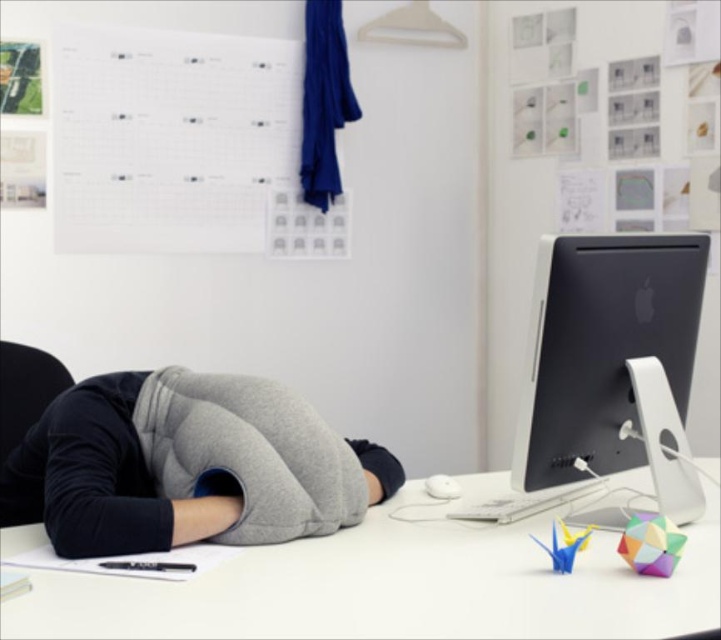
Can you confirm if white paperboard at upper center is wider than gray fleece pillow at center?

Indeed, white paperboard at upper center has a greater width compared to gray fleece pillow at center.

In the scene shown: Is white paperboard at upper center taller than gray fleece pillow at center?

Yes.

Is point (288, 116) positioned after point (120, 547)?

Yes, point (288, 116) is farther from viewer.

The width and height of the screenshot is (721, 640). I want to click on white paperboard at upper center, so click(x=181, y=145).

Between white matte computer desk at center and gray fleece pillow at center, which one has more height?

gray fleece pillow at center is taller.

Does point (319, 593) come farther from viewer compared to point (99, 433)?

No, (319, 593) is closer to viewer.

I want to click on white matte computer desk at center, so click(x=393, y=586).

Which is more to the left, gray fleece pillow at center or black matte desktop computer at right?

Positioned to the left is gray fleece pillow at center.

Does point (35, 454) lie behind point (663, 484)?

Yes, it is behind point (663, 484).

Who is more forward, (115, 465) or (561, 474)?

Positioned in front is point (115, 465).

I want to click on gray fleece pillow at center, so click(185, 464).